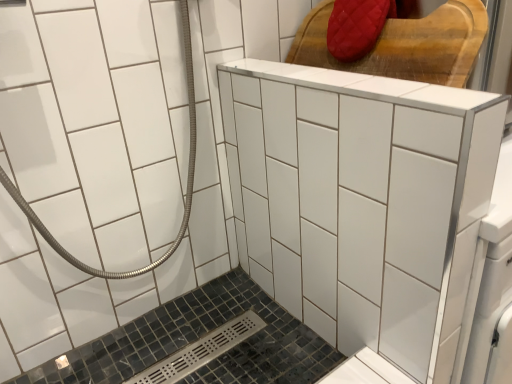
I want to click on black mosaic tile bath at lower left, so click(199, 338).

Image resolution: width=512 pixels, height=384 pixels. I want to click on red quilted fabric at upper right, so click(404, 44).

From a real-world perspective, is white glossy ceramic tile at center above or below red quilted fabric at upper right?

white glossy ceramic tile at center is situated lower than red quilted fabric at upper right in the real world.

Who is bigger, white glossy ceramic tile at center or red quilted fabric at upper right?

white glossy ceramic tile at center.

Based on the photo, considering the relative positions of white glossy ceramic tile at center and red quilted fabric at upper right in the image provided, is white glossy ceramic tile at center behind red quilted fabric at upper right?

No, it is not.

Is the surface of white glossy ceramic tile at center in direct contact with red quilted fabric at upper right?

No, white glossy ceramic tile at center is not making contact with red quilted fabric at upper right.

Is red quilted fabric at upper right directly adjacent to white glossy ceramic tile at center?

They are not placed beside each other.

Considering the sizes of red quilted fabric at upper right and white glossy ceramic tile at center in the image, is red quilted fabric at upper right wider or thinner than white glossy ceramic tile at center?

In the image, red quilted fabric at upper right appears to be wider than white glossy ceramic tile at center.

In the image, there is a red quilted fabric at upper right. Where is `ceramic tile below it (from a real-world perspective)`? Image resolution: width=512 pixels, height=384 pixels. ceramic tile below it (from a real-world perspective) is located at coordinates (362, 202).

Would you say white glossy ceramic tile at center is part of red quilted fabric at upper right's contents?

No, white glossy ceramic tile at center is located outside of red quilted fabric at upper right.

Is black mosaic tile bath at lower left at the back of red quilted fabric at upper right?

No.

Between red quilted fabric at upper right and black mosaic tile bath at lower left, which one appears on the right side from the viewer's perspective?

red quilted fabric at upper right is more to the right.

Choose the correct answer: Is red quilted fabric at upper right inside black mosaic tile bath at lower left or outside it?

red quilted fabric at upper right lies outside black mosaic tile bath at lower left.

Looking at this image, can you confirm if red quilted fabric at upper right is smaller than black mosaic tile bath at lower left?

Indeed, red quilted fabric at upper right has a smaller size compared to black mosaic tile bath at lower left.

From the picture: Does white glossy ceramic tile at center have a larger size compared to black mosaic tile bath at lower left?

Correct, white glossy ceramic tile at center is larger in size than black mosaic tile bath at lower left.

In terms of height, does white glossy ceramic tile at center look taller or shorter compared to black mosaic tile bath at lower left?

In the image, white glossy ceramic tile at center appears to be taller than black mosaic tile bath at lower left.

What's the angular difference between white glossy ceramic tile at center and black mosaic tile bath at lower left's facing directions?

91.8 degrees.

From a real-world perspective, is white glossy ceramic tile at center positioned under black mosaic tile bath at lower left based on gravity?

No, from a real-world perspective, white glossy ceramic tile at center is not below black mosaic tile bath at lower left.

Based on the photo, between black mosaic tile bath at lower left and white glossy ceramic tile at center, which one has less height?

With less height is black mosaic tile bath at lower left.

Where is `ceramic tile on the right of black mosaic tile bath at lower left`? The width and height of the screenshot is (512, 384). ceramic tile on the right of black mosaic tile bath at lower left is located at coordinates (362, 202).

Considering the positions of objects black mosaic tile bath at lower left and white glossy ceramic tile at center in the image provided, who is more to the right, black mosaic tile bath at lower left or white glossy ceramic tile at center?

Positioned to the right is white glossy ceramic tile at center.

Considering the relative sizes of black mosaic tile bath at lower left and white glossy ceramic tile at center in the image provided, is black mosaic tile bath at lower left smaller than white glossy ceramic tile at center?

Yes.

Is red quilted fabric at upper right at the back of black mosaic tile bath at lower left?

That's not correct — black mosaic tile bath at lower left is not looking away from red quilted fabric at upper right.

From a real-world perspective, is black mosaic tile bath at lower left physically above red quilted fabric at upper right?

No.

Considering the relative sizes of black mosaic tile bath at lower left and red quilted fabric at upper right in the image provided, is black mosaic tile bath at lower left thinner than red quilted fabric at upper right?

In fact, black mosaic tile bath at lower left might be wider than red quilted fabric at upper right.

Considering the sizes of objects black mosaic tile bath at lower left and red quilted fabric at upper right in the image provided, who is taller, black mosaic tile bath at lower left or red quilted fabric at upper right?

red quilted fabric at upper right is taller.

Locate an element on the screen. furniture above the white glossy ceramic tile at center (from the image's perspective) is located at coordinates (404, 44).

There is a white glossy ceramic tile at center. At what (x,y) coordinates should I click in order to perform the action: click on furniture above it (from a real-world perspective). Please return your answer as a coordinate pair (x, y). Looking at the image, I should click on (404, 44).

Looking at the image, which one is located further to white glossy ceramic tile at center, black mosaic tile bath at lower left or red quilted fabric at upper right?

The object further to white glossy ceramic tile at center is black mosaic tile bath at lower left.

Based on the photo, considering their positions, is white glossy ceramic tile at center positioned further to black mosaic tile bath at lower left than red quilted fabric at upper right?

red quilted fabric at upper right.

Estimate the real-world distances between objects in this image. Which object is further from red quilted fabric at upper right, white glossy ceramic tile at center or black mosaic tile bath at lower left?

black mosaic tile bath at lower left is positioned further to the anchor red quilted fabric at upper right.

Considering their positions, is black mosaic tile bath at lower left positioned further to red quilted fabric at upper right than white glossy ceramic tile at center?

Based on the image, black mosaic tile bath at lower left appears to be further to red quilted fabric at upper right.

Considering their positions, is red quilted fabric at upper right positioned closer to white glossy ceramic tile at center than black mosaic tile bath at lower left?

The object closer to white glossy ceramic tile at center is red quilted fabric at upper right.

From the image, which object appears to be farther from black mosaic tile bath at lower left, red quilted fabric at upper right or white glossy ceramic tile at center?

red quilted fabric at upper right.

The image size is (512, 384). Identify the location of ceramic tile between red quilted fabric at upper right and black mosaic tile bath at lower left in the vertical direction. 362,202.